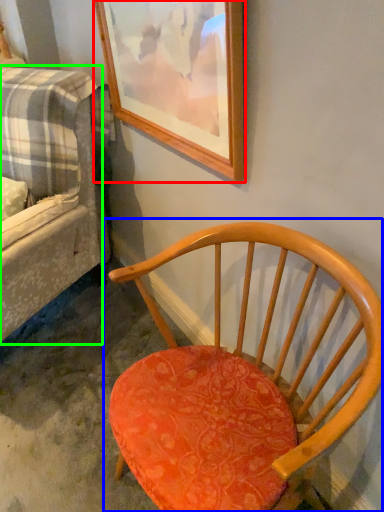
Question: Which object is the closest to the picture frame (highlighted by a red box)? Choose among these: chair (highlighted by a blue box) or studio couch (highlighted by a green box).

Choices:
 (A) chair
 (B) studio couch

Answer: (B)